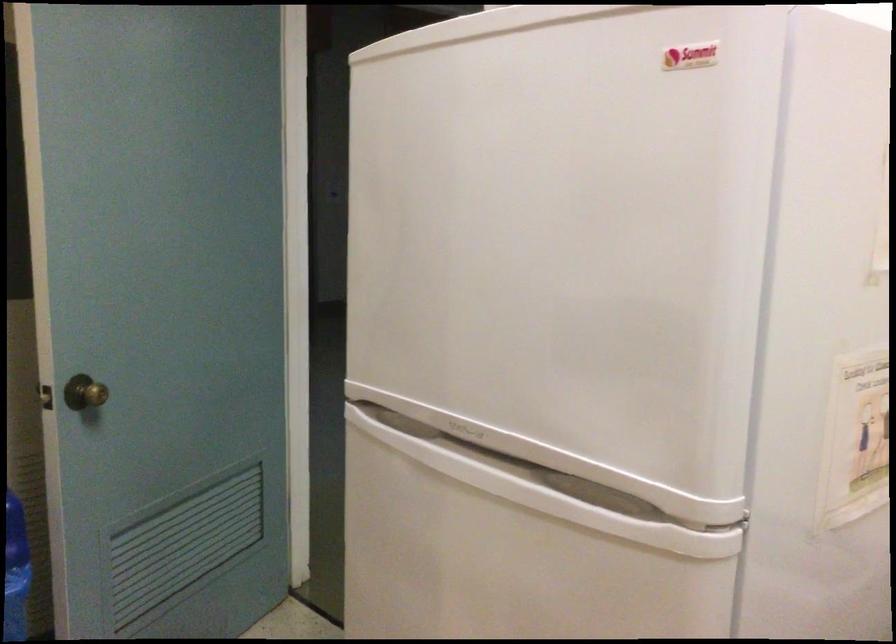
At what (x,y) coordinates should I click in order to perform the action: click on freezer door handle. Please return your answer as a coordinate pair (x, y). The image size is (896, 644). Looking at the image, I should click on (644, 514).